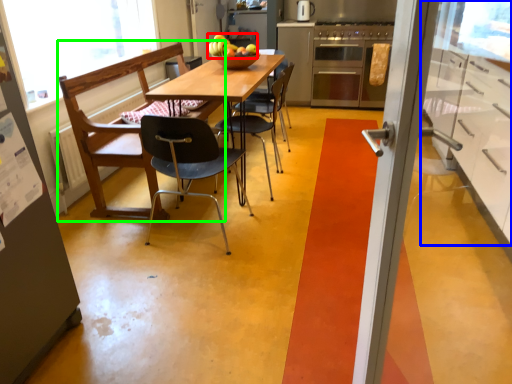
Question: Which object is the farthest from fruit (highlighted by a red box)? Choose among these: cabinetry (highlighted by a blue box) or chair (highlighted by a green box).

Choices:
 (A) cabinetry
 (B) chair

Answer: (A)